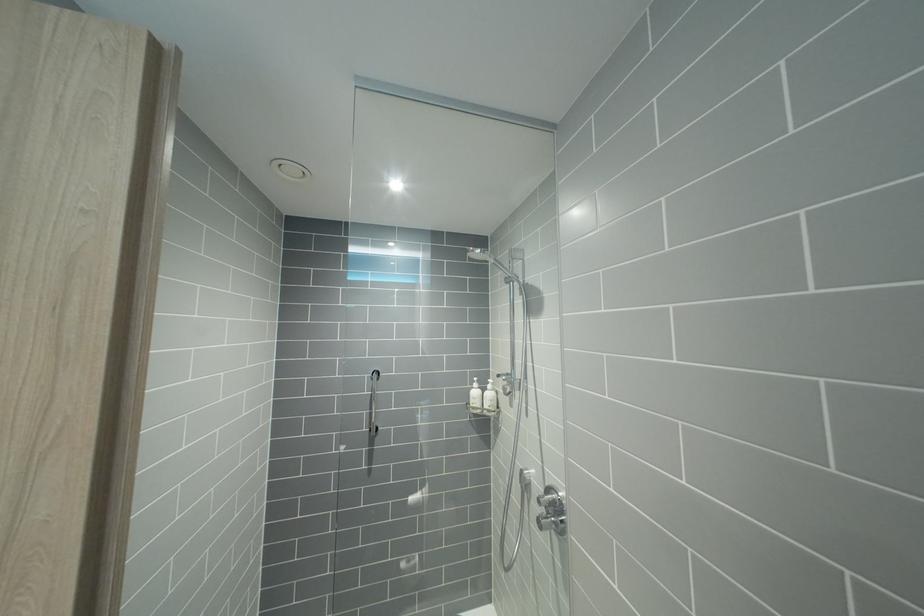
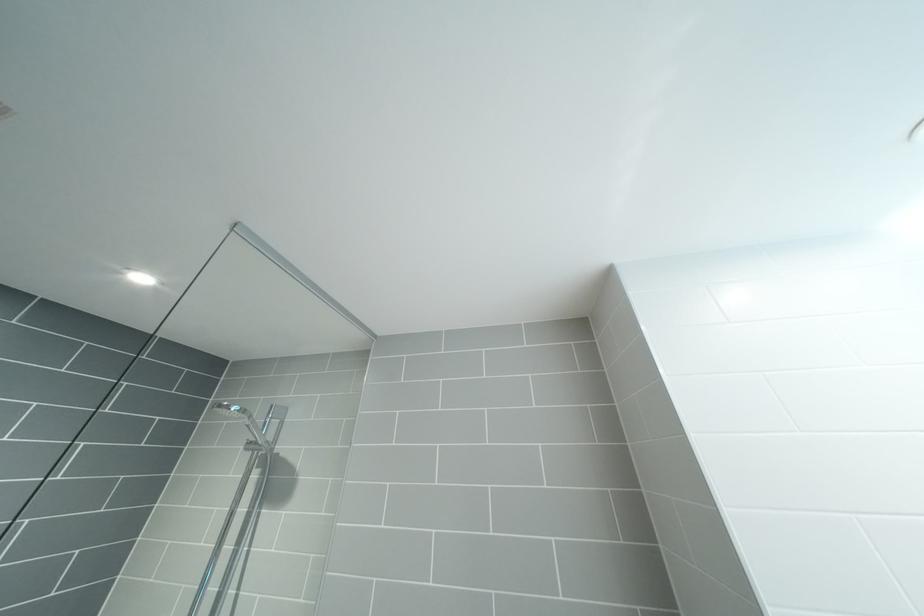
Based on the continuous images, in which direction is the camera rotating?

The camera's rotation is toward right-up.